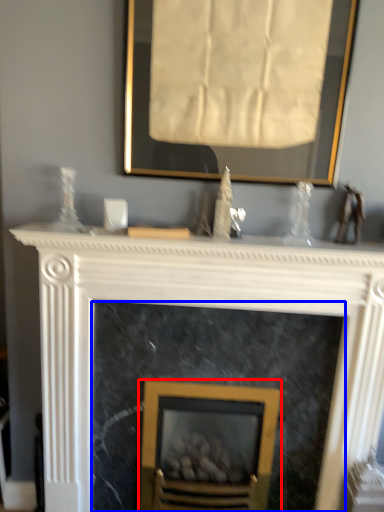
Question: Which point is further to the camera, fireplace (highlighted by a red box) or fireplace (highlighted by a blue box)?

Choices:
 (A) fireplace
 (B) fireplace

Answer: (A)